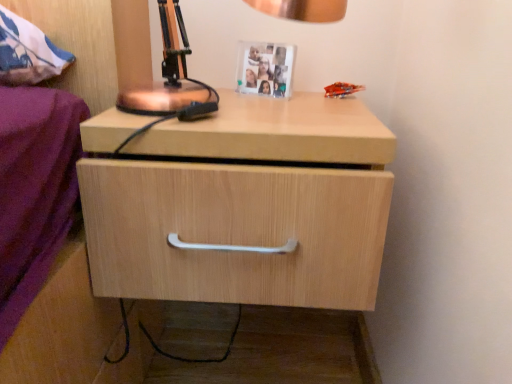
Where is `empty space that is to the right of white plastic picture frame at upper center`? This screenshot has width=512, height=384. empty space that is to the right of white plastic picture frame at upper center is located at coordinates (310, 96).